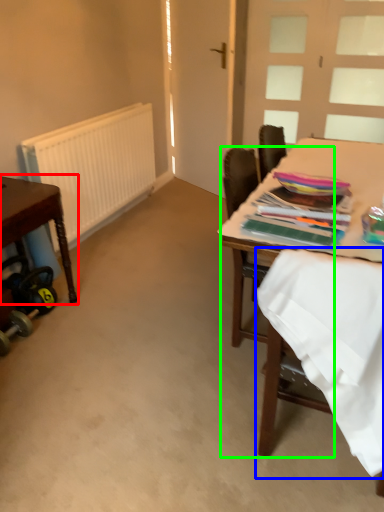
Question: Which is nearer to the table (highlighted by a red box)? fabric (highlighted by a blue box) or chair (highlighted by a green box).

Choices:
 (A) fabric
 (B) chair

Answer: (B)